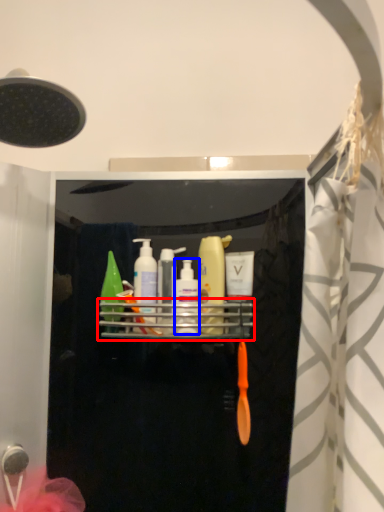
Question: Which object is further to the camera taking this photo, shelf (highlighted by a red box) or mouthwash (highlighted by a blue box)?

Choices:
 (A) shelf
 (B) mouthwash

Answer: (B)